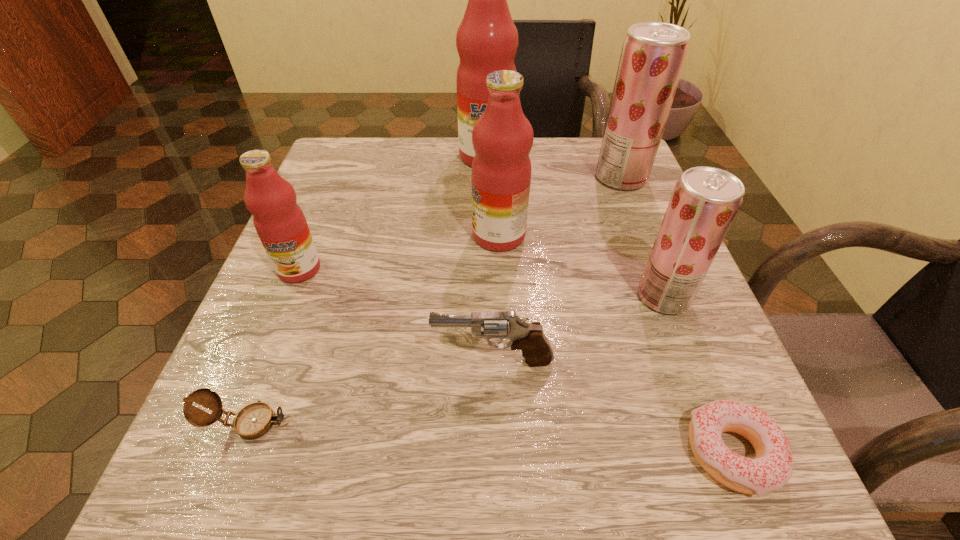
You are a GUI agent. You are given a task and a screenshot of the screen. Output one action in this format:
    pyautogui.click(x=<x>, y=<y>)
    Task: Click on the free spot located at the barrel of the sixth farthest object
    
    Given the screenshot: What is the action you would take?
    pyautogui.click(x=256, y=361)

This screenshot has height=540, width=960. Identify the location of vacant space located 0.100m at the barrel of the sixth farthest object. (366, 361).

The height and width of the screenshot is (540, 960). I want to click on blank space located at the barrel of the sixth farthest object, so click(256, 361).

Image resolution: width=960 pixels, height=540 pixels. What are the coordinates of `vacant space located 0.320m on the face of the compass` in the screenshot? It's located at (537, 422).

Locate an element on the screen. The width and height of the screenshot is (960, 540). vacant space situated 0.170m on the left of the white doughnut is located at coordinates (552, 454).

The width and height of the screenshot is (960, 540). Find the location of `compass present at the near edge`. compass present at the near edge is located at coordinates (254, 420).

This screenshot has width=960, height=540. Find the location of `doughnut at the near edge`. doughnut at the near edge is located at coordinates (772, 467).

The width and height of the screenshot is (960, 540). I want to click on fruit juice located in the left edge section of the desktop, so click(280, 223).

Locate an element on the screen. This screenshot has width=960, height=540. compass at the left edge is located at coordinates (254, 420).

Image resolution: width=960 pixels, height=540 pixels. I want to click on doughnut located at the right edge, so click(x=772, y=467).